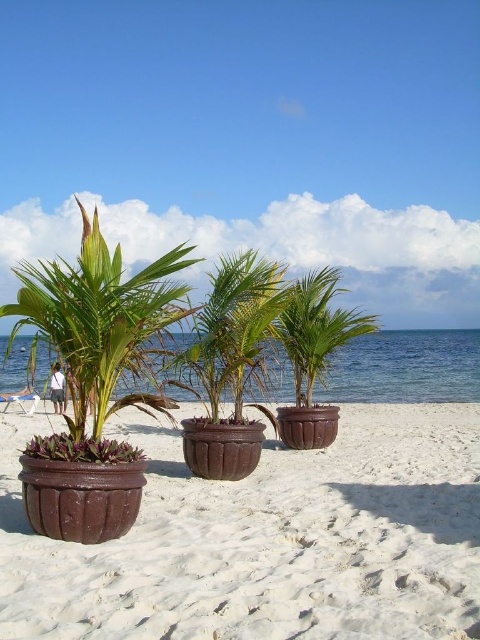
Question: Is brown textured sand at center above matte brown pot at left?

Choices:
 (A) yes
 (B) no

Answer: (B)

Question: In this image, where is brown textured sand at center located relative to brown textured pot at center?

Choices:
 (A) above
 (B) below

Answer: (B)

Question: Which of the following is the farthest from the observer?

Choices:
 (A) matte brown pot at left
 (B) brown textured sand at center

Answer: (A)

Question: Observing the image, what is the correct spatial positioning of brown textured sand at center in reference to matte brown pot at left?

Choices:
 (A) above
 (B) below

Answer: (B)

Question: Which object is positioned farthest from the brown textured sand at center?

Choices:
 (A) matte brown pot at left
 (B) brown textured pot at center

Answer: (A)

Question: Which is nearer to the matte brown pot at left?

Choices:
 (A) brown textured sand at center
 (B) brown textured pot at center

Answer: (A)